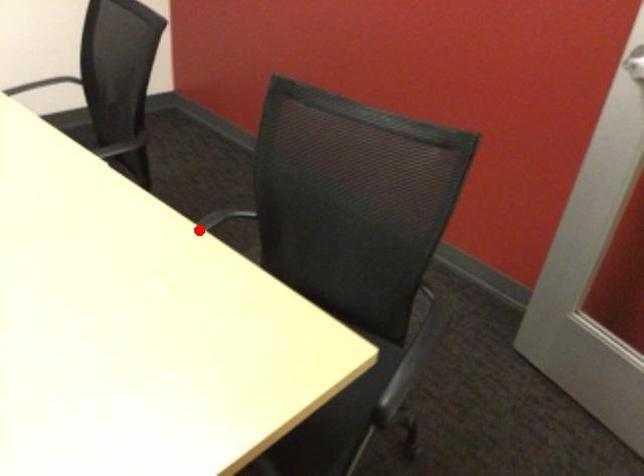
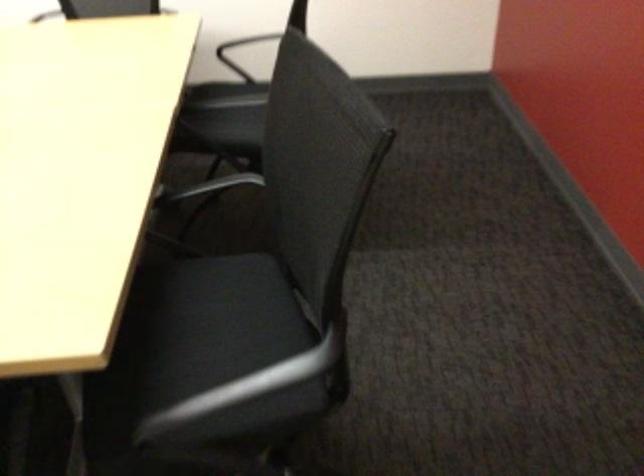
In the second image, find the point that corresponds to the highlighted location in the first image.

(209, 186)